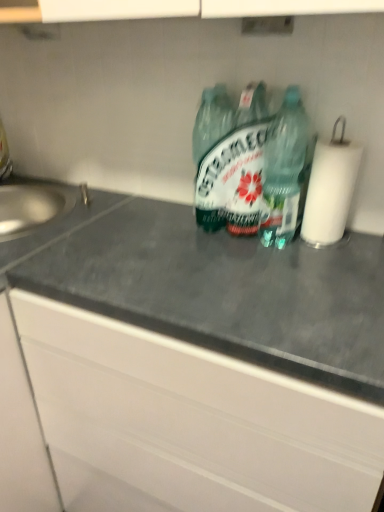
Where is `free space on the front side of green translucent bottle at center, which appears as the second bottle when viewed from the left`? This screenshot has width=384, height=512. free space on the front side of green translucent bottle at center, which appears as the second bottle when viewed from the left is located at coordinates (291, 275).